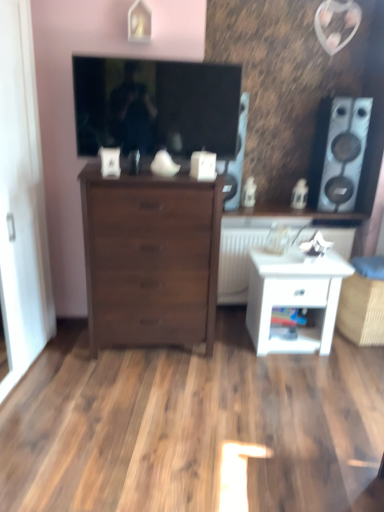
Locate an element on the screen. The image size is (384, 512). empty space that is in between dark wood chest of drawers at center and white glossy nightstand at lower right is located at coordinates (229, 336).